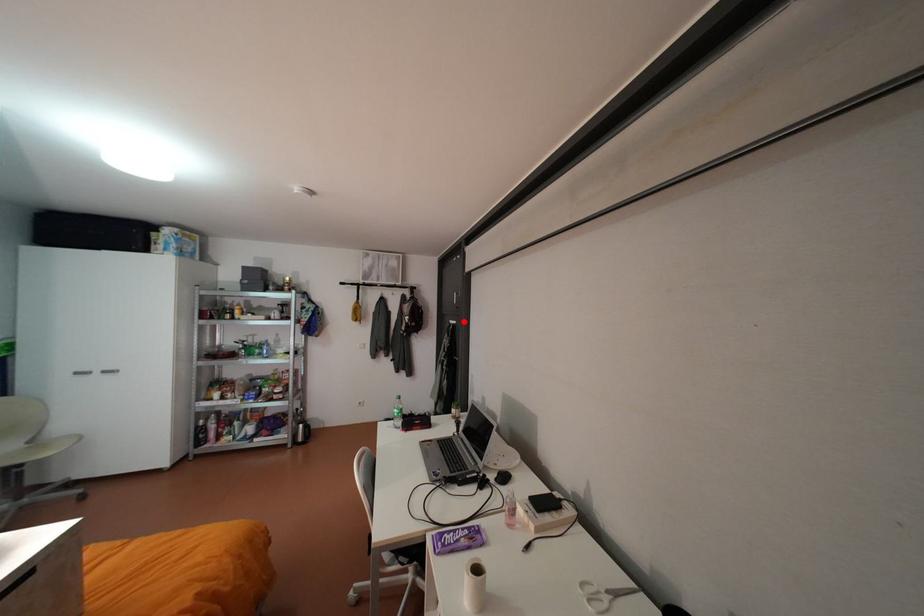
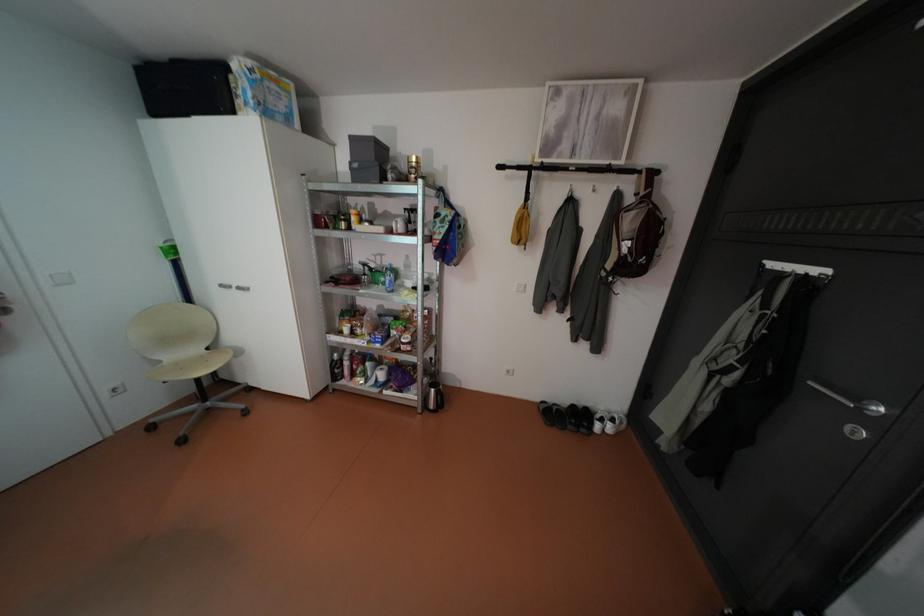
In the second image, find the point that corresponds to the highlighted location in the first image.

(827, 270)